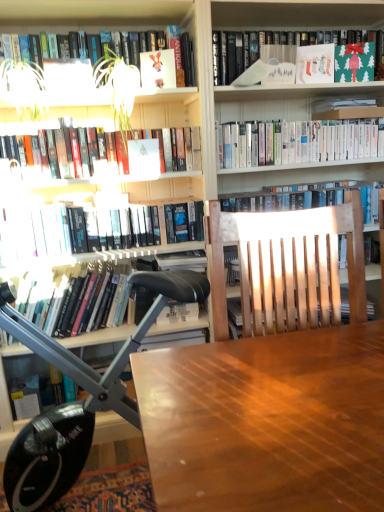
Question: Can you confirm if green leafy plant at upper left is taller than black leather chair at left?

Choices:
 (A) yes
 (B) no

Answer: (B)

Question: From the image's perspective, is green leafy plant at upper left located beneath black leather chair at left?

Choices:
 (A) no
 (B) yes

Answer: (A)

Question: Would you say green leafy plant at upper left is a long distance from black leather chair at left?

Choices:
 (A) no
 (B) yes

Answer: (A)

Question: Can black leather chair at left be found inside green leafy plant at upper left?

Choices:
 (A) no
 (B) yes

Answer: (A)

Question: Is green leafy plant at upper left facing towards black leather chair at left?

Choices:
 (A) yes
 (B) no

Answer: (B)

Question: Visually, is matte white book at upper center, which is counted as the 4th paperback book, starting from the right, positioned to the left or to the right of wooden table at center?

Choices:
 (A) left
 (B) right

Answer: (A)

Question: Is matte white book at upper center, which is counted as the 4th paperback book, starting from the right, taller or shorter than wooden table at center?

Choices:
 (A) tall
 (B) short

Answer: (B)

Question: Does point (155, 83) appear closer or farther from the camera than point (360, 422)?

Choices:
 (A) farther
 (B) closer

Answer: (A)

Question: From a real-world perspective, is matte white book at upper center, which is counted as the 4th paperback book, starting from the right, positioned above or below wooden table at center?

Choices:
 (A) below
 (B) above

Answer: (B)

Question: From a real-world perspective, relative to matte paper stocking at upper right, arranged as the 2th paperback book when viewed from the right, is green paper bag at upper right, which is the seventh book from bottom to top, vertically above or below?

Choices:
 (A) above
 (B) below

Answer: (A)

Question: In the image, is green paper bag at upper right, marked as the 1th book in a top-to-bottom arrangement, on the left side or the right side of matte paper stocking at upper right, marked as the 3th paperback book in a left-to-right arrangement?

Choices:
 (A) left
 (B) right

Answer: (A)

Question: Would you say green paper bag at upper right, marked as the 1th book in a top-to-bottom arrangement, is inside or outside matte paper stocking at upper right, marked as the 3th paperback book in a left-to-right arrangement?

Choices:
 (A) outside
 (B) inside

Answer: (A)

Question: From the image's perspective, is green paper bag at upper right, marked as the 1th book in a top-to-bottom arrangement, above or below matte paper stocking at upper right, marked as the 3th paperback book in a left-to-right arrangement?

Choices:
 (A) above
 (B) below

Answer: (A)

Question: Is point (226, 44) closer or farther from the camera than point (115, 114)?

Choices:
 (A) farther
 (B) closer

Answer: (A)

Question: Do you think green paper bag at upper right, marked as the 1th book in a top-to-bottom arrangement, is within green leafy plant at upper left, or outside of it?

Choices:
 (A) outside
 (B) inside

Answer: (A)